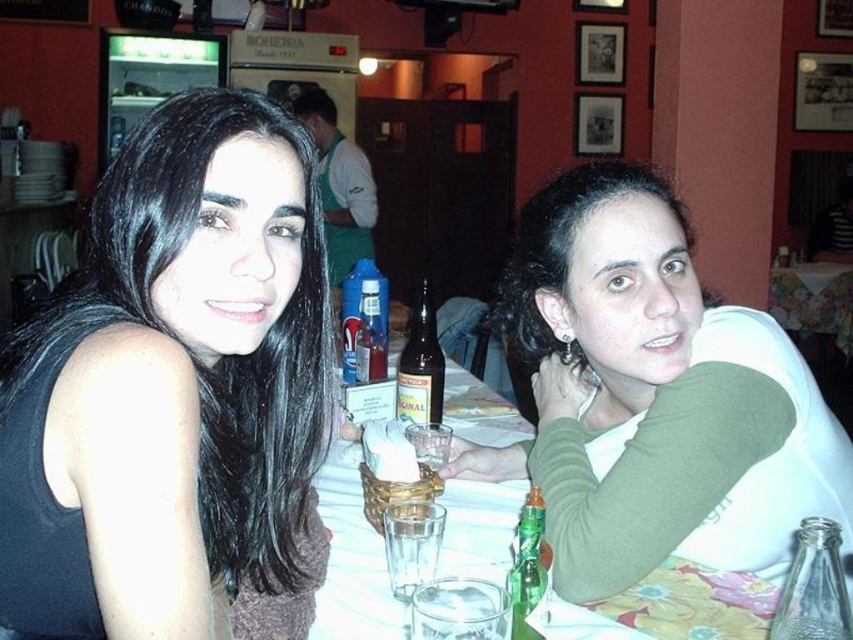
Can you confirm if green matte shirt at upper right is shorter than translucent plastic bottle at center?

In fact, green matte shirt at upper right may be taller than translucent plastic bottle at center.

Is green matte shirt at upper right in front of translucent plastic bottle at center?

Yes, it is.

What are the coordinates of `green matte shirt at upper right` in the screenshot? It's located at (653, 396).

Does translucent glass table at center appear on the left side of green glass bottle at center?

Correct, you'll find translucent glass table at center to the left of green glass bottle at center.

What do you see at coordinates (352, 561) in the screenshot?
I see `translucent glass table at center` at bounding box center [352, 561].

Where is `translucent glass table at center`? The height and width of the screenshot is (640, 853). translucent glass table at center is located at coordinates (352, 561).

Which of these two, green matte shirt at upper right or transparent glass bottle at lower right, stands shorter?

With less height is transparent glass bottle at lower right.

Does point (646, 499) come closer to viewer compared to point (840, 612)?

No, (646, 499) is further to viewer.

Does point (596, 166) come closer to viewer compared to point (813, 540)?

No, it is behind (813, 540).

Where is `green matte shirt at upper right`? green matte shirt at upper right is located at coordinates (653, 396).